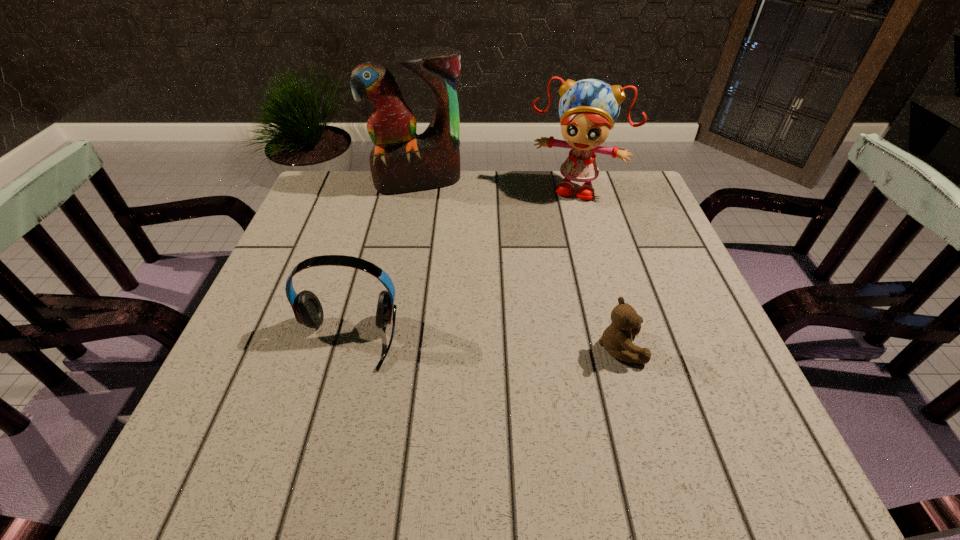
In order to click on vacant position in the image that satisfies the following two spatial constraints: 1. with the microphone attached to the side of the shortest object; 2. on the front-facing side of the third tallest object in this screenshot , I will do `click(345, 348)`.

Locate an element on the screen. This screenshot has height=540, width=960. vacant space that satisfies the following two spatial constraints: 1. on the front side of the teddy bear; 2. on the front-facing side of the parrot is located at coordinates (387, 348).

The image size is (960, 540). Identify the location of free space that satisfies the following two spatial constraints: 1. with the microphone attached to the side of the third tallest object; 2. on the front-facing side of the shortest object. (345, 348).

Where is `free region that satisfies the following two spatial constraints: 1. on the front side of the teddy bear; 2. on the front-facing side of the tallest object`? The image size is (960, 540). free region that satisfies the following two spatial constraints: 1. on the front side of the teddy bear; 2. on the front-facing side of the tallest object is located at coordinates (387, 348).

Locate an element on the screen. blank space that satisfies the following two spatial constraints: 1. with the microphone attached to the side of the shortest object; 2. on the front-facing side of the second shortest object is located at coordinates (345, 348).

Identify the location of vacant area in the image that satisfies the following two spatial constraints: 1. with the microphone attached to the side of the teddy bear; 2. on the front-facing side of the headset. This screenshot has width=960, height=540. (345, 348).